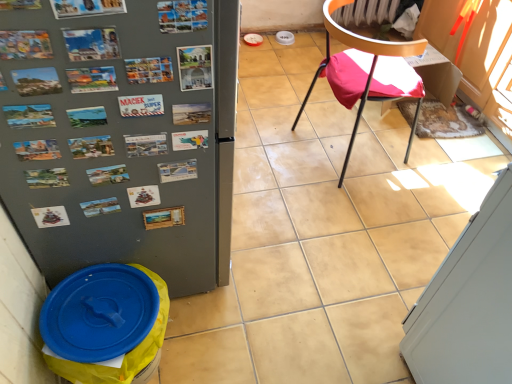
Locate an element on the screen. free space in front of metallic black chair at center right is located at coordinates (358, 214).